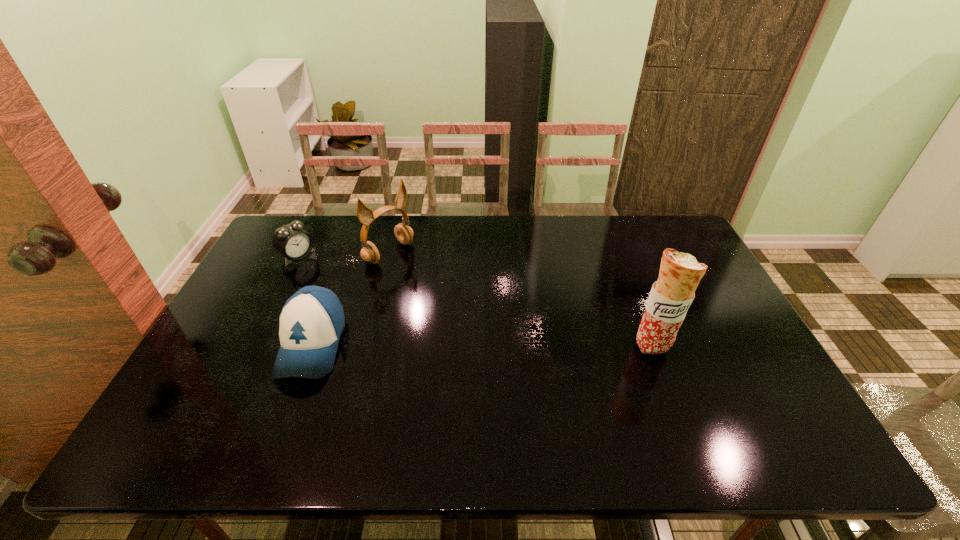
The width and height of the screenshot is (960, 540). In order to click on baseball cap in this screenshot , I will do `click(312, 320)`.

I want to click on burrito, so click(x=680, y=273).

Locate an element on the screen. the rightmost object is located at coordinates (680, 273).

Image resolution: width=960 pixels, height=540 pixels. Find the location of `the second tallest object`. the second tallest object is located at coordinates (369, 252).

Locate an element on the screen. alarm clock is located at coordinates (292, 241).

Image resolution: width=960 pixels, height=540 pixels. What are the coordinates of `free spot located on the back of the rightmost object` in the screenshot? It's located at (624, 271).

The height and width of the screenshot is (540, 960). In order to click on free space located 0.340m on the front-facing side of the second tallest object in this screenshot , I will do `click(482, 314)`.

At what (x,y) coordinates should I click in order to perform the action: click on vacant area situated 0.190m on the front-facing side of the second tallest object. Please return your answer as a coordinate pair (x, y). Looking at the image, I should click on (445, 290).

At what (x,y) coordinates should I click in order to perform the action: click on vacant area situated 0.290m on the front-facing side of the second tallest object. Please return your answer as a coordinate pair (x, y). Image resolution: width=960 pixels, height=540 pixels. Looking at the image, I should click on (468, 306).

At what (x,y) coordinates should I click in order to perform the action: click on vacant space located 0.330m on the front side of the alarm clock. Please return your answer as a coordinate pair (x, y). The height and width of the screenshot is (540, 960). Looking at the image, I should click on (378, 307).